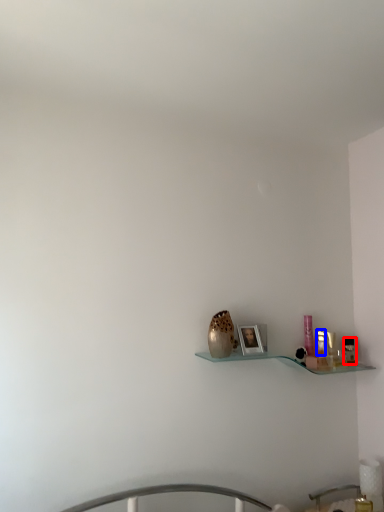
Question: Which of the following is the closest to the observer, toiletry (highlighted by a red box) or toiletry (highlighted by a blue box)?

Choices:
 (A) toiletry
 (B) toiletry

Answer: (B)